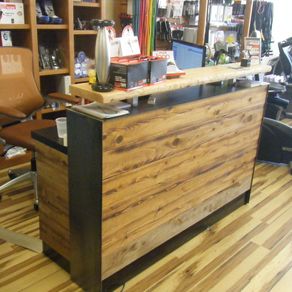
Where is `desk`? This screenshot has width=292, height=292. desk is located at coordinates (134, 154).